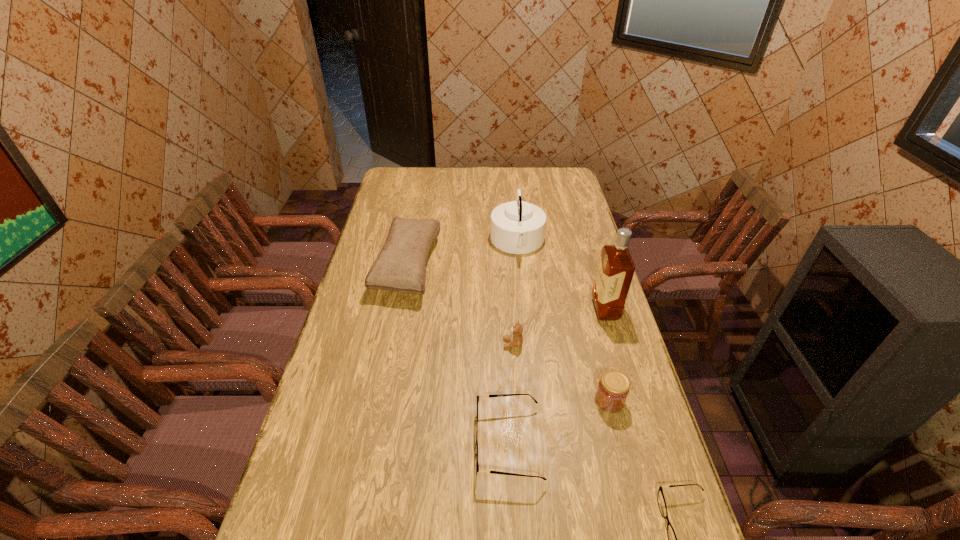
Given the evenly spaced spectacless in the image, where should an extra spectacles be added on the left to preserve the spacing? Please point to a vacant space. Please provide its 2D coordinates. Your answer should be formatted as a tuple, i.e. [(x, y)], where the tuple contains the x and y coordinates of a point satisfying the conditions above.

[(371, 381)]